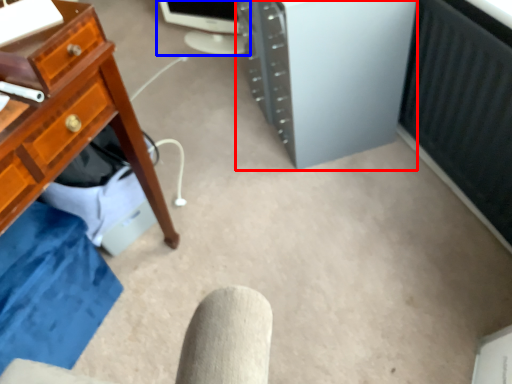
Question: Which of the following is the closest to the observer, computer tower (highlighted by a red box) or desktop computer (highlighted by a blue box)?

Choices:
 (A) computer tower
 (B) desktop computer

Answer: (A)